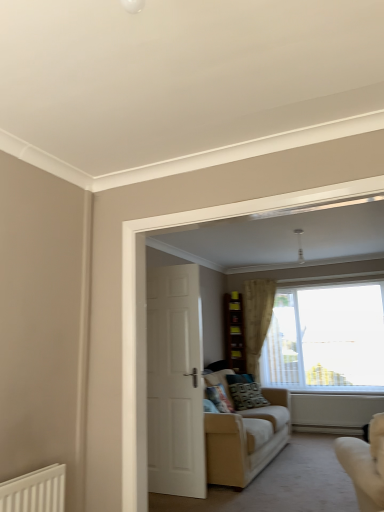
Question: In the image, is patterned fabric pillow at center, the first pillow when ordered from back to front, on the left side or the right side of white glossy door at center?

Choices:
 (A) left
 (B) right

Answer: (B)

Question: Looking at the image, does patterned fabric pillow at center, the 1th pillow from the right, seem bigger or smaller compared to white glossy door at center?

Choices:
 (A) big
 (B) small

Answer: (B)

Question: Which is nearer to the patterned fabric pillow at center, which is the second pillow in left-to-right order?

Choices:
 (A) transparent glass window at center
 (B) white glossy door at center
 (C) beige fabric couch at center, which is the first studio couch in back-to-front order
 (D) sheer beige curtain at center
 (E) patterned fabric pillow at center, positioned as the 2th pillow in right-to-left order

Answer: (E)

Question: Estimate the real-world distances between objects in this image. Which object is closer to the brown wooden bookshelf at center?

Choices:
 (A) white glossy door at center
 (B) beige fabric couch at lower right, marked as the 1th studio couch in a front-to-back arrangement
 (C) sheer beige curtain at center
 (D) patterned fabric pillow at center, the 1th pillow from the right
 (E) beige fabric couch at center, acting as the 2th studio couch starting from the front

Answer: (C)